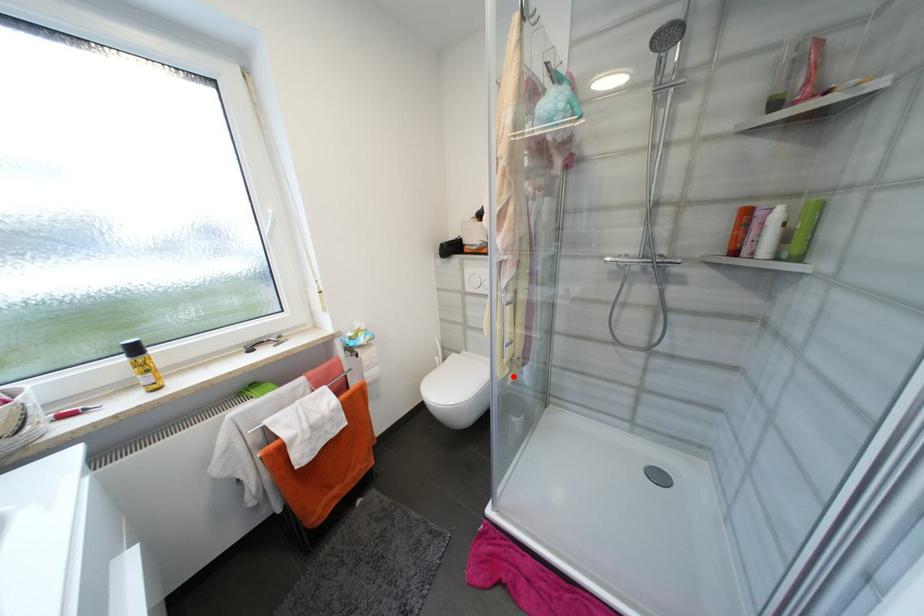
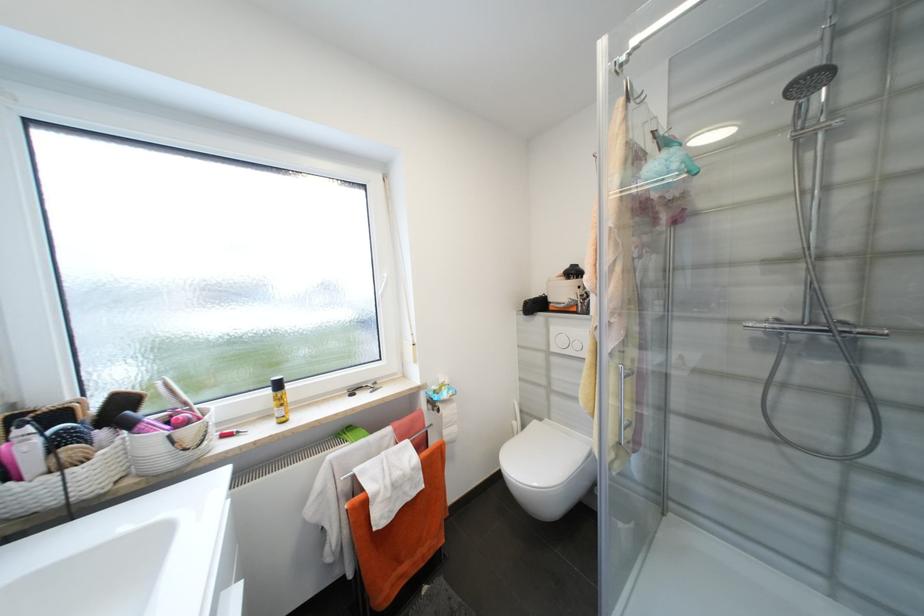
Find the pixel in the second image that matches the highlighted location in the first image.

(618, 463)